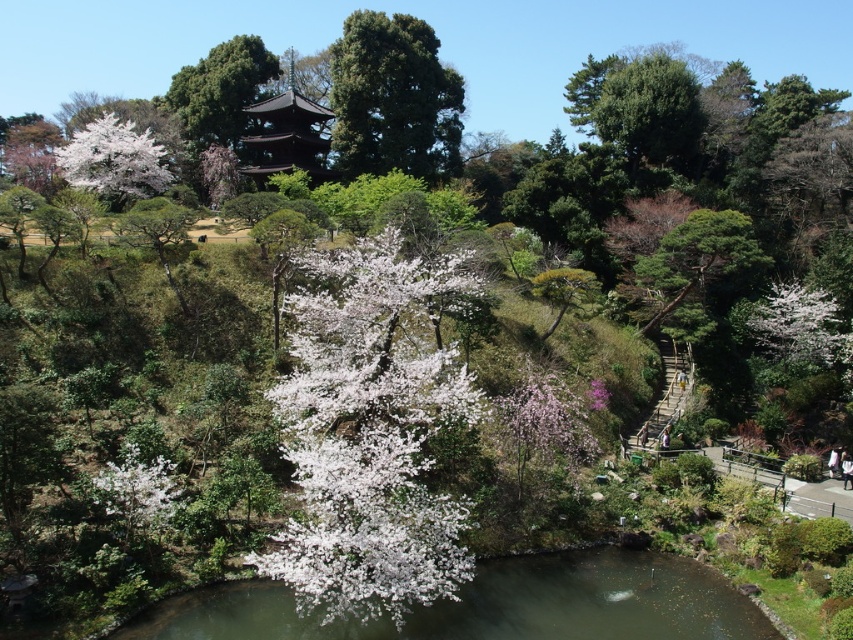
You are a visitor walking along the pathway in the Japanese garden. You want to take a photo of the white matte flower at upper right without the green textured tree at upper center blocking the view. Is this possible?

The green textured tree at upper center is positioned over the white matte flower at upper right, so it will block the view of the flower. You cannot take a photo of the white matte flower at upper right without the tree blocking it.

You are a photographer standing at the camera position in the Japanese garden scene. You want to capture a closeup shot of the white matte flower at center. Considering the distance between you and the flower, do you think you can reach it by walking straight ahead without any obstacles? The garden has no fences or barriers.

The white matte flower at center is 19.44 meters away from the camera position. Since there are no obstacles mentioned in the scene description, you can walk straight ahead to reach it.

You are a gardener planning to plant a new flower bed in the garden. You have two options for the center area where the white matte flower at center and pink silky blossoms at center are currently located. The new flowers you want to plant require a minimum of 30 cm of space between each plant. Given the current sizes of the existing flowers, can you determine if the spacing between them is sufficient for your new plants?

The white matte flower at center is bigger than pink silky blossoms at center, but the exact spacing between them isn generated in the provided information. Therefore, it is impossible to determine if the current spacing meets the 30 cm requirement without additional measurements.